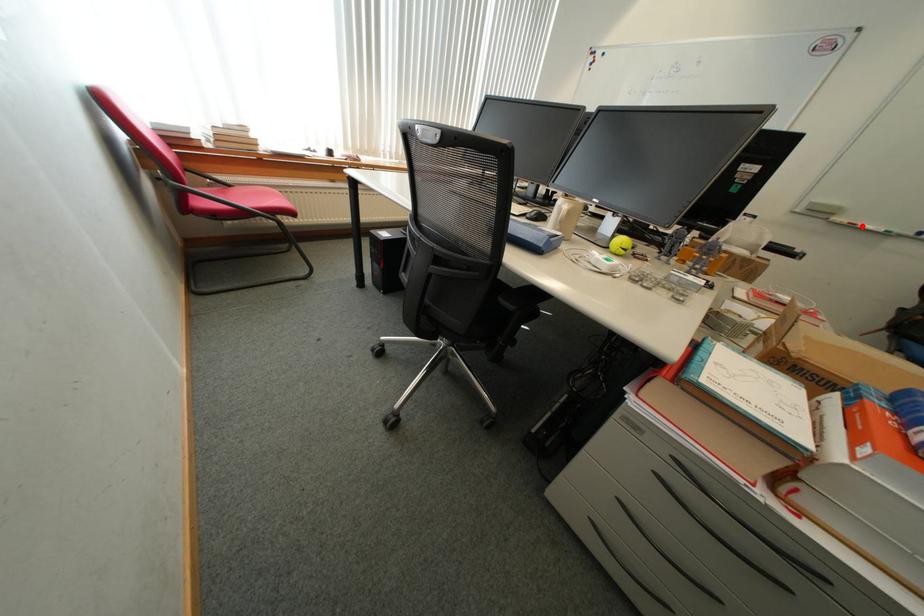
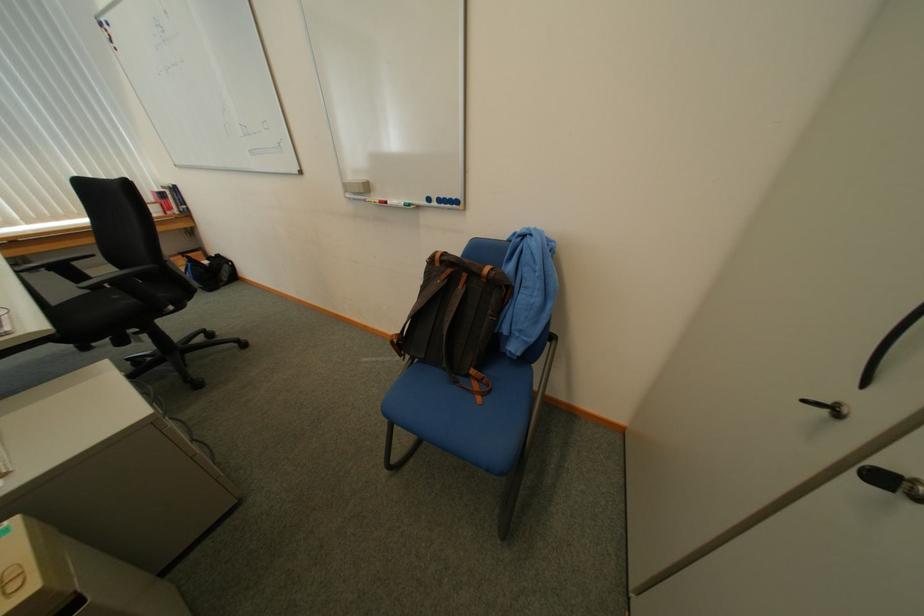
Question: I am providing you with two images of the same scene from different viewpoints. Given a red point in image1, look at the same physical point in image2. Is it:

Choices:
 (A) Closer to the viewpoint
 (B) Farther from the viewpoint

Answer: (A)